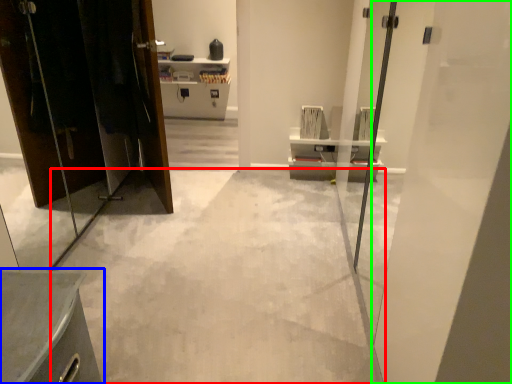
Question: Estimate the real-world distances between objects in this image. Which object is closer to concrete (highlighted by a red box), furniture (highlighted by a blue box) or door (highlighted by a green box)?

Choices:
 (A) furniture
 (B) door

Answer: (A)